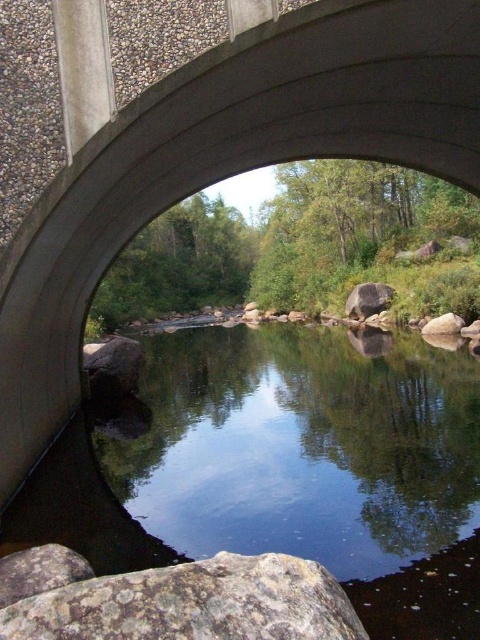
You are standing on the bridge and want to toss a small pebble into the clear water at center. To ensure it lands in the water, should you aim above or below the smooth gray rock at right?

The clear water at center is taller than the smooth gray rock at right, so you should aim below the smooth gray rock at right to ensure the pebble lands in the water.

You are standing on the concrete bridge and see a point marked at coordinates (x=111, y=365). What is the location of this point relative to the gray rough rock at lower left?

The point at (x=111, y=365) is located on the gray rough rock at lower left.